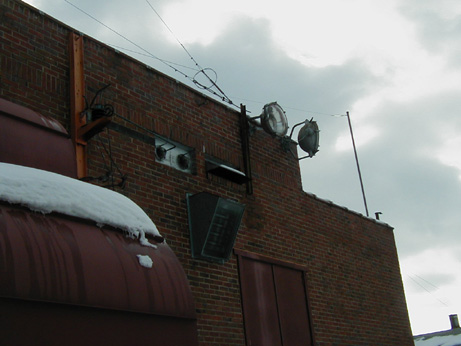
The width and height of the screenshot is (461, 346). In order to click on wires in this screenshot , I will do `click(431, 291)`, `click(180, 37)`, `click(124, 33)`.